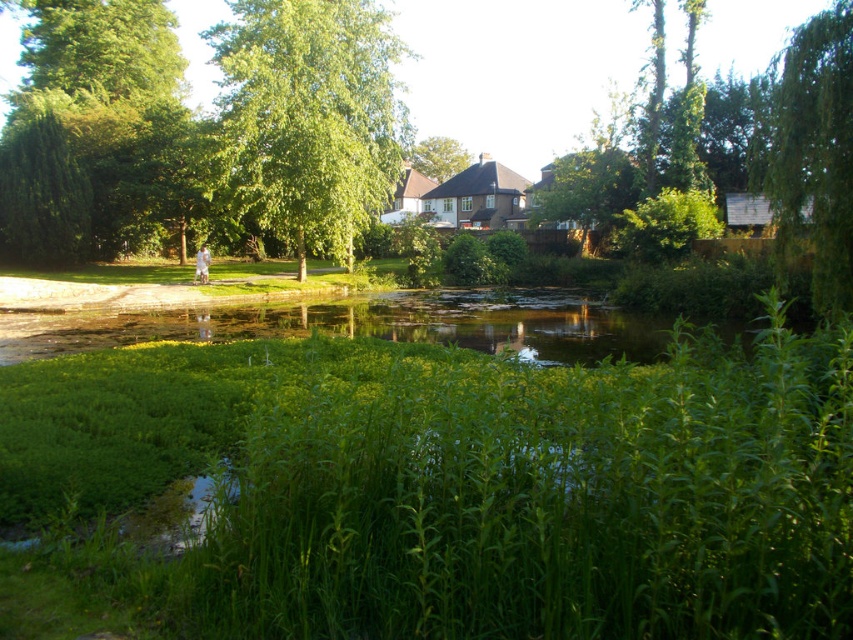
Question: Which point appears closest to the camera in this image?

Choices:
 (A) (757, 108)
 (B) (433, 164)

Answer: (A)

Question: Which is nearer to the green leafy tree at upper left?

Choices:
 (A) green leafy grass at center
 (B) green leafy tree at center

Answer: (A)

Question: Can you confirm if green leafy tree at upper left is positioned to the left of green leafy tree at right?

Choices:
 (A) yes
 (B) no

Answer: (A)

Question: Is green leafy tree at right to the left of green leafy tree at center from the viewer's perspective?

Choices:
 (A) no
 (B) yes

Answer: (A)

Question: Can you confirm if green leafy grass at center is positioned above green leafy tree at center?

Choices:
 (A) no
 (B) yes

Answer: (A)

Question: Based on their relative distances, which object is farther from the green leafy tree at upper left?

Choices:
 (A) green leafy tree at right
 (B) green leafy grass at center

Answer: (B)